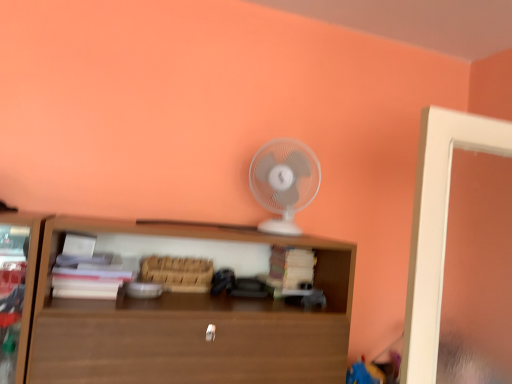
Identify the location of brown wooden shelf at center. (183, 308).

The height and width of the screenshot is (384, 512). What do you see at coordinates (183, 308) in the screenshot?
I see `brown wooden shelf at center` at bounding box center [183, 308].

Measure the distance between point (68,266) and camera.

They are 4.02 feet apart.

What is the approximate height of white plastic fan at upper center?

12.79 inches.

What do you see at coordinates (284, 182) in the screenshot? I see `white plastic fan at upper center` at bounding box center [284, 182].

The image size is (512, 384). I want to click on white plastic fan at upper center, so click(x=284, y=182).

This screenshot has height=384, width=512. I want to click on brown wooden shelf at center, so click(183, 308).

In the image, is brown wooden shelf at center on the left side or the right side of white plastic fan at upper center?

In the image, brown wooden shelf at center appears on the left side of white plastic fan at upper center.

Is brown wooden shelf at center behind white plastic fan at upper center?

No, brown wooden shelf at center is closer to the camera.

Which is behind, point (136, 339) or point (289, 164)?

Positioned behind is point (289, 164).

From the image's perspective, would you say brown wooden shelf at center is positioned over white plastic fan at upper center?

No, from the image's perspective, brown wooden shelf at center is not above white plastic fan at upper center.

From a real-world perspective, is brown wooden shelf at center physically located above or below white plastic fan at upper center?

In terms of real-world spatial position, brown wooden shelf at center is below white plastic fan at upper center.

Is brown wooden shelf at center wider or thinner than white plastic fan at upper center?

In the image, brown wooden shelf at center appears to be wider than white plastic fan at upper center.

Who is taller, brown wooden shelf at center or white plastic fan at upper center?

brown wooden shelf at center is taller.

Considering the relative sizes of brown wooden shelf at center and white plastic fan at upper center in the image provided, is brown wooden shelf at center bigger than white plastic fan at upper center?

Correct, brown wooden shelf at center is larger in size than white plastic fan at upper center.

Is brown wooden shelf at center not inside white plastic fan at upper center?

That's correct, brown wooden shelf at center is outside of white plastic fan at upper center.

Would you consider brown wooden shelf at center to be distant from white plastic fan at upper center?

No, brown wooden shelf at center is not far away from white plastic fan at upper center.

Is brown wooden shelf at center aimed at white plastic fan at upper center?

No.

Measure the distance between brown wooden shelf at center and white plastic fan at upper center.

brown wooden shelf at center and white plastic fan at upper center are 14.20 inches apart from each other.

In order to click on mechanical fan above the brown wooden shelf at center (from a real-world perspective) in this screenshot , I will do `click(284, 182)`.

Between white plastic fan at upper center and brown wooden shelf at center, which one appears on the left side from the viewer's perspective?

Positioned to the left is brown wooden shelf at center.

Which object is more forward, white plastic fan at upper center or brown wooden shelf at center?

Positioned in front is brown wooden shelf at center.

Does point (304, 165) come farther from viewer compared to point (348, 271)?

Yes, point (304, 165) is farther from viewer.

From the image's perspective, is white plastic fan at upper center located above brown wooden shelf at center?

Yes, from the image's perspective, white plastic fan at upper center is over brown wooden shelf at center.

Based on the photo, from a real-world perspective, relative to brown wooden shelf at center, is white plastic fan at upper center vertically above or below?

white plastic fan at upper center is above brown wooden shelf at center.

In terms of width, does white plastic fan at upper center look wider or thinner when compared to brown wooden shelf at center?

In the image, white plastic fan at upper center appears to be more narrow than brown wooden shelf at center.

Considering the sizes of objects white plastic fan at upper center and brown wooden shelf at center in the image provided, who is taller, white plastic fan at upper center or brown wooden shelf at center?

Standing taller between the two is brown wooden shelf at center.

Considering the sizes of white plastic fan at upper center and brown wooden shelf at center in the image, is white plastic fan at upper center bigger or smaller than brown wooden shelf at center?

white plastic fan at upper center is smaller than brown wooden shelf at center.

Is brown wooden shelf at center located within white plastic fan at upper center?

Definitely not — brown wooden shelf at center is not inside white plastic fan at upper center.

Is white plastic fan at upper center far away from brown wooden shelf at center?

Actually, white plastic fan at upper center and brown wooden shelf at center are a little close together.

Is white plastic fan at upper center facing away from brown wooden shelf at center?

No, white plastic fan at upper center is not facing the opposite direction of brown wooden shelf at center.

The height and width of the screenshot is (384, 512). In order to click on shelf that appears below the white plastic fan at upper center (from the image's perspective) in this screenshot , I will do [183, 308].

I want to click on mechanical fan that appears behind the brown wooden shelf at center, so click(x=284, y=182).

Identify the location of shelf located below the white plastic fan at upper center (from the image's perspective). (183, 308).